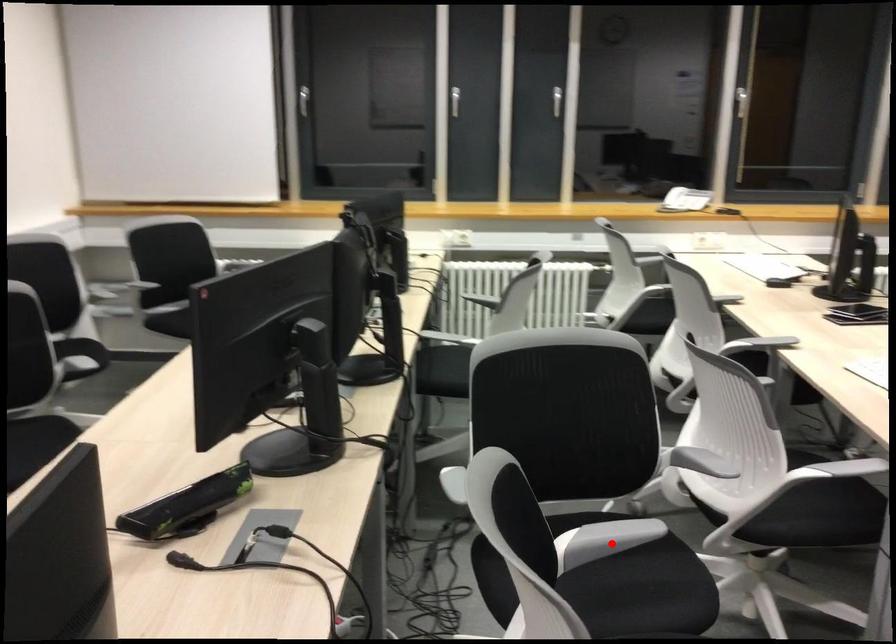
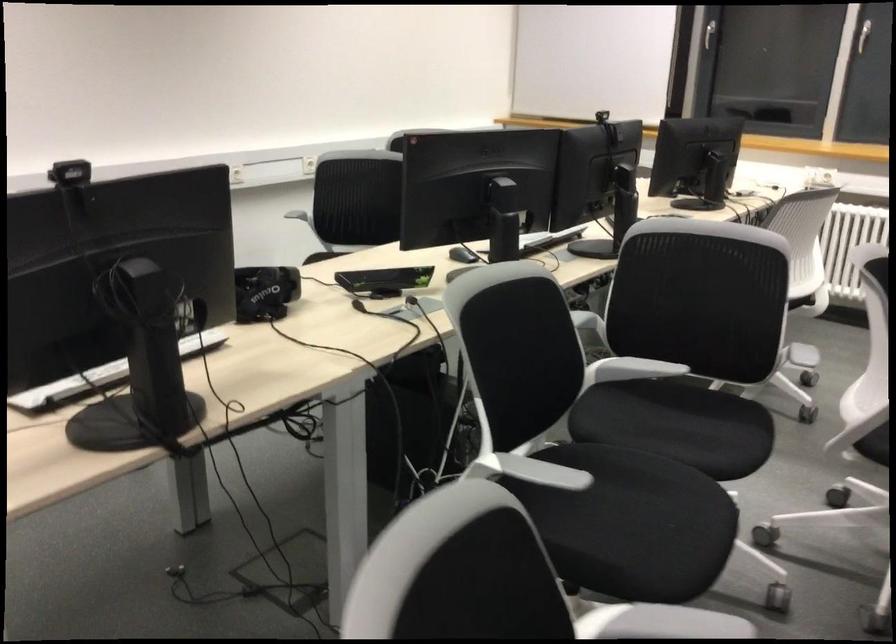
Question: I am providing you with two images of the same scene from different viewpoints. Given a red point in image1, look at the same physical point in image2. Is it:

Choices:
 (A) Closer to the viewpoint
 (B) Farther from the viewpoint

Answer: (B)